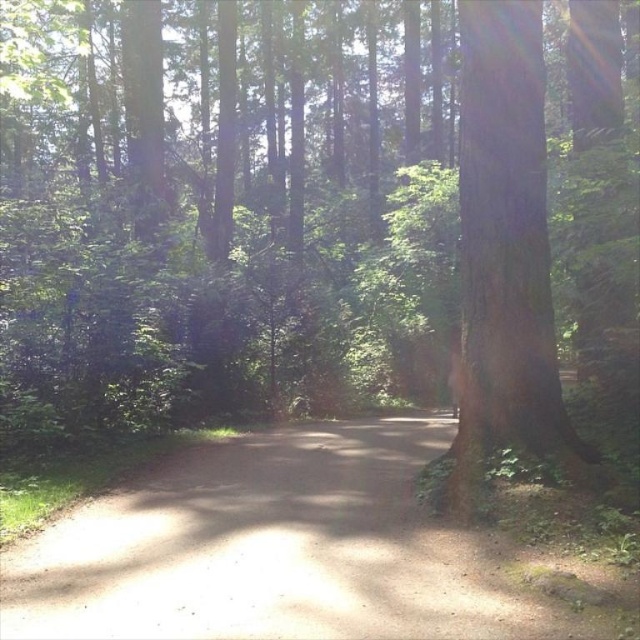
You are a hiker with a 3D map of the forest. The map shows the dirt path at center and the smooth brown tree trunk at right. Which object on the map has a smaller size?

The dirt path at center has a smaller size compared to the smooth brown tree trunk at right, so the dirt path at center is the smaller one.

You are a hiker planning to walk along the dirt path at center. If you start at the beginning of the path, which direction should you face to walk towards the point specified at coordinates 0.861, 0.439?

The dirt path at center is located at point (280,550), so you should face towards that coordinate to walk along the dirt path at center in the correct direction.

You are a hiker walking along the dirt path at center and see the smooth brown tree trunk at right. Which direction should you turn to get closer to the tree trunk?

You should turn to the right to get closer to the smooth brown tree trunk at right because the dirt path at center is to the left of it.